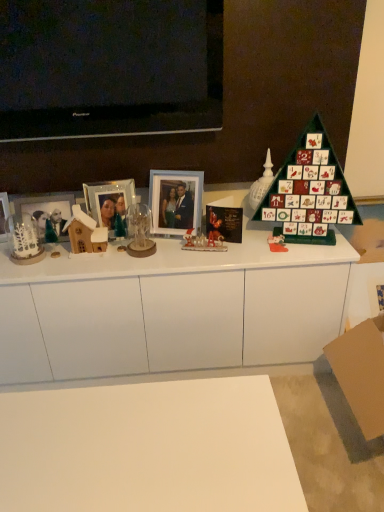
This screenshot has height=512, width=384. I want to click on vacant space that is in between clear glass ornament at center, arranged as the third toy when viewed from the left, and matte plastic advent calendar at right, which appears as the first toy when viewed from the right, so click(213, 249).